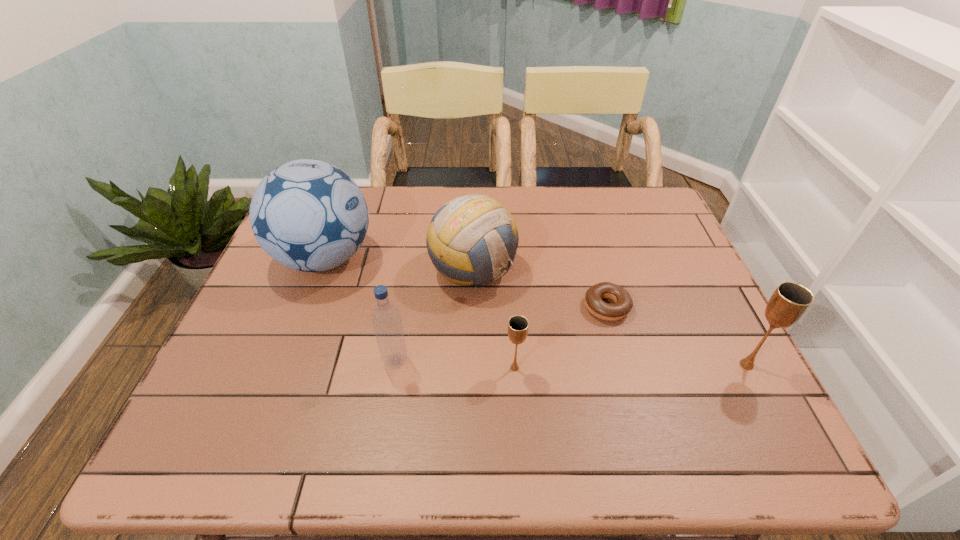
This screenshot has height=540, width=960. Find the location of `the shorter chalice`. the shorter chalice is located at coordinates (518, 325).

Where is `the fifth tallest object`? This screenshot has width=960, height=540. the fifth tallest object is located at coordinates (518, 325).

The height and width of the screenshot is (540, 960). I want to click on the right chalice, so click(x=789, y=302).

Image resolution: width=960 pixels, height=540 pixels. I want to click on the taller chalice, so click(x=789, y=302).

Identify the location of volleyball. This screenshot has height=540, width=960. (471, 240).

The height and width of the screenshot is (540, 960). I want to click on the second object from right to left, so click(x=623, y=303).

At what (x,y) coordinates should I click in order to perform the action: click on the shortest object. Please return your answer as a coordinate pair (x, y). This screenshot has height=540, width=960. Looking at the image, I should click on (623, 303).

Locate an element on the screen. Image resolution: width=960 pixels, height=540 pixels. the leftmost object is located at coordinates (308, 215).

In order to click on soccer ball in this screenshot , I will do `click(308, 215)`.

Identify the location of water bottle. (386, 319).